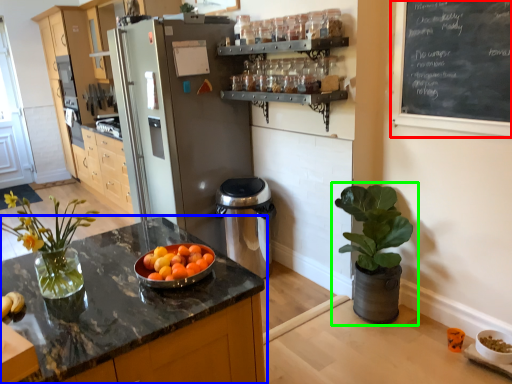
Question: Estimate the real-world distances between objects in this image. Which object is closer to bulletin board (highlighted by a red box), countertop (highlighted by a blue box) or houseplant (highlighted by a green box)?

Choices:
 (A) countertop
 (B) houseplant

Answer: (B)